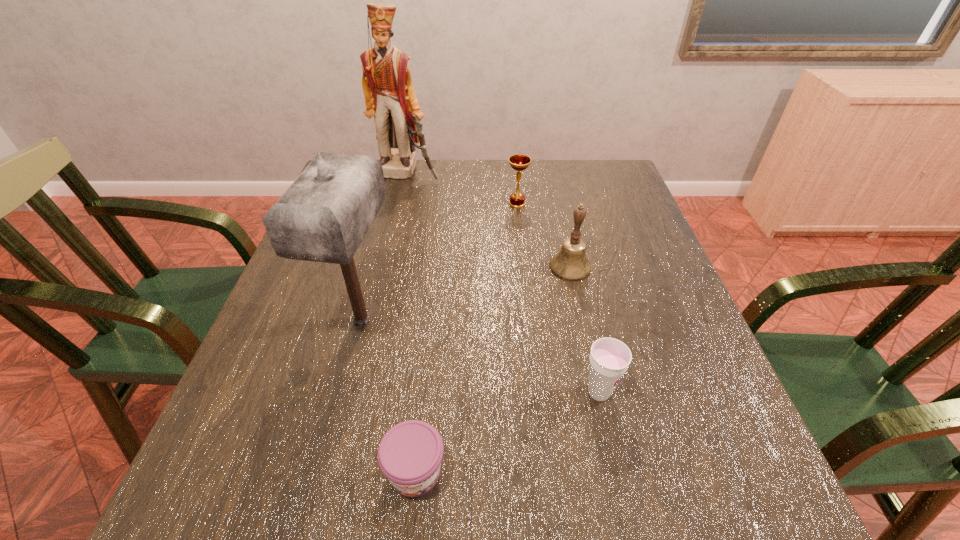
The height and width of the screenshot is (540, 960). I want to click on vacant area between the fifth nearest object and the cup, so click(x=558, y=298).

The width and height of the screenshot is (960, 540). I want to click on free spot between the fifth shortest object and the second shortest object, so click(x=480, y=356).

This screenshot has height=540, width=960. In order to click on free area in between the fourth shortest object and the chalice in this screenshot , I will do coord(543,235).

This screenshot has width=960, height=540. I want to click on free space that is in between the second tallest object and the second farthest object, so click(440, 262).

At what (x,y) coordinates should I click in order to perform the action: click on free space between the fourth object from left to right and the jam. Please return your answer as a coordinate pair (x, y). Image resolution: width=960 pixels, height=540 pixels. Looking at the image, I should click on (467, 338).

This screenshot has height=540, width=960. I want to click on vacant space in between the second farthest object and the shortest object, so click(x=467, y=338).

The width and height of the screenshot is (960, 540). Find the location of `free space between the second shortest object and the nutcracker`. free space between the second shortest object and the nutcracker is located at coordinates (503, 283).

Locate an element on the screen. vacant space that's between the fourth farthest object and the jam is located at coordinates (389, 396).

Identify the location of object that stands as the fifth closest to the second tallest object. This screenshot has width=960, height=540. (389, 94).

The height and width of the screenshot is (540, 960). I want to click on the second closest object relative to the fourth shortest object, so click(609, 359).